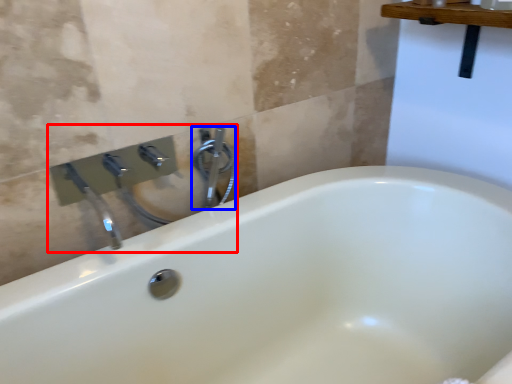
Question: Which object is further to the camera taking this photo, sink (highlighted by a red box) or plumbing fixture (highlighted by a blue box)?

Choices:
 (A) sink
 (B) plumbing fixture

Answer: (B)